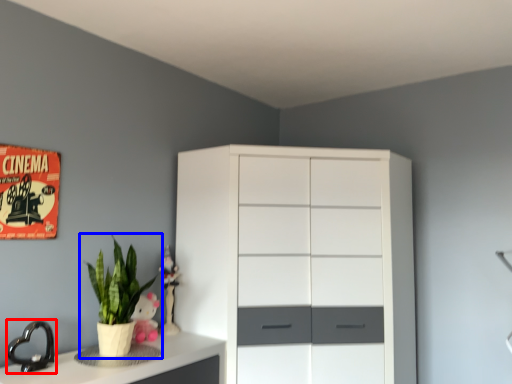
Question: Which point is further to the camera, faucet (highlighted by a red box) or houseplant (highlighted by a blue box)?

Choices:
 (A) faucet
 (B) houseplant

Answer: (B)